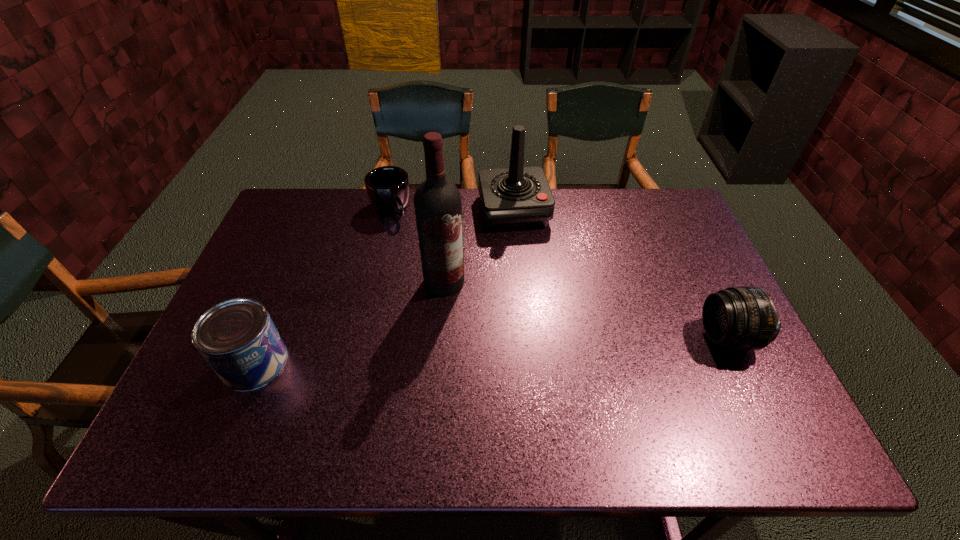
Find the location of a particular element. free space on the desktop that is between the leftmost object and the rightmost object and is positioned on the label of the third object from right to left is located at coordinates (439, 353).

The width and height of the screenshot is (960, 540). I want to click on free spot on the desktop that is between the leftmost object and the rightmost object and is positioned on the side of the fourth object from right to left with the handle, so click(x=488, y=350).

I want to click on free space on the desktop that is between the can and the rightmost object and is positioned on the front-facing side of the second tallest object, so coord(548,347).